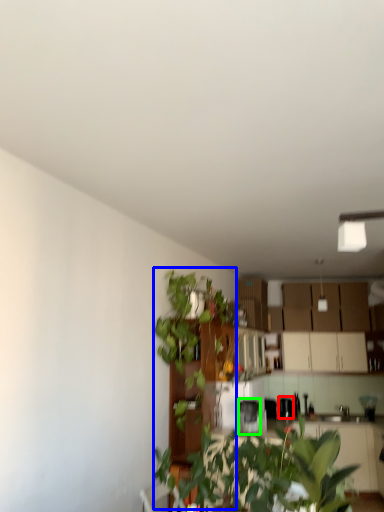
Question: Based on their relative distances, which object is nearer to appliance (highlighted by a red box)? Choose from vegetation (highlighted by a blue box) and appliance (highlighted by a green box).

Choices:
 (A) vegetation
 (B) appliance

Answer: (B)